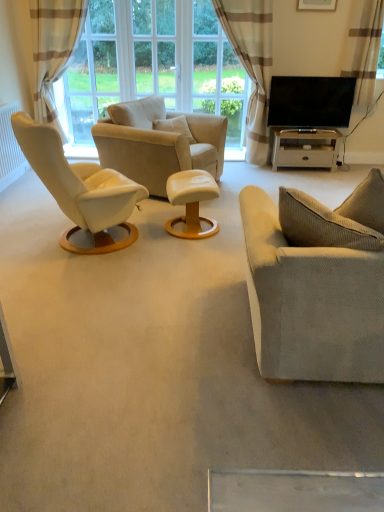
Question: From the image's perspective, is clear glass window at center, which ranks as the 1th window screen in right-to-left order, located beneath white glossy table at lower right, the 1th table viewed from the back?

Choices:
 (A) yes
 (B) no

Answer: (B)

Question: From the image's perspective, would you say clear glass window at center, placed as the 3th window screen when sorted from left to right, is positioned over white glossy table at lower right, the first table from the right?

Choices:
 (A) yes
 (B) no

Answer: (A)

Question: Considering the relative sizes of clear glass window at center, which ranks as the 1th window screen in right-to-left order, and white glossy table at lower right, the second table positioned from the bottom, in the image provided, is clear glass window at center, which ranks as the 1th window screen in right-to-left order, shorter than white glossy table at lower right, the second table positioned from the bottom,?

Choices:
 (A) yes
 (B) no

Answer: (B)

Question: From a real-world perspective, is clear glass window at center, which ranks as the 1th window screen in right-to-left order, on top of white glossy table at lower right, marked as the first table in a top-to-bottom arrangement?

Choices:
 (A) yes
 (B) no

Answer: (A)

Question: Is clear glass window at center, which ranks as the 1th window screen in right-to-left order, positioned beyond the bounds of white glossy table at lower right, marked as the first table in a top-to-bottom arrangement?

Choices:
 (A) yes
 (B) no

Answer: (A)

Question: Does clear glass window at center, placed as the 3th window screen when sorted from left to right, have a smaller size compared to white glossy table at lower right, the 1th table viewed from the back?

Choices:
 (A) no
 (B) yes

Answer: (A)

Question: Is transparent glass window at upper center, marked as the first window screen in a left-to-right arrangement, positioned in front of white glossy table at lower right, which ranks as the 2th table in front-to-back order?

Choices:
 (A) no
 (B) yes

Answer: (A)

Question: Is transparent glass window at upper center, arranged as the third window screen when viewed from the right, touching white glossy table at lower right, which ranks as the 2th table in front-to-back order?

Choices:
 (A) yes
 (B) no

Answer: (B)

Question: From a real-world perspective, is transparent glass window at upper center, marked as the first window screen in a left-to-right arrangement, on white glossy table at lower right, the 1th table viewed from the back?

Choices:
 (A) yes
 (B) no

Answer: (A)

Question: Is transparent glass window at upper center, marked as the first window screen in a left-to-right arrangement, not inside white glossy table at lower right, the second table positioned from the bottom?

Choices:
 (A) yes
 (B) no

Answer: (A)

Question: Is transparent glass window at upper center, marked as the first window screen in a left-to-right arrangement, thinner than white glossy table at lower right, the first table from the right?

Choices:
 (A) no
 (B) yes

Answer: (B)

Question: Would you say transparent glass window at upper center, arranged as the third window screen when viewed from the right, contains white glossy table at lower right, the second table positioned from the bottom?

Choices:
 (A) yes
 (B) no

Answer: (B)

Question: Is clear glass window at center, which ranks as the 1th window screen in right-to-left order, a part of transparent glass window at upper center, arranged as the third window screen when viewed from the right?

Choices:
 (A) yes
 (B) no

Answer: (B)